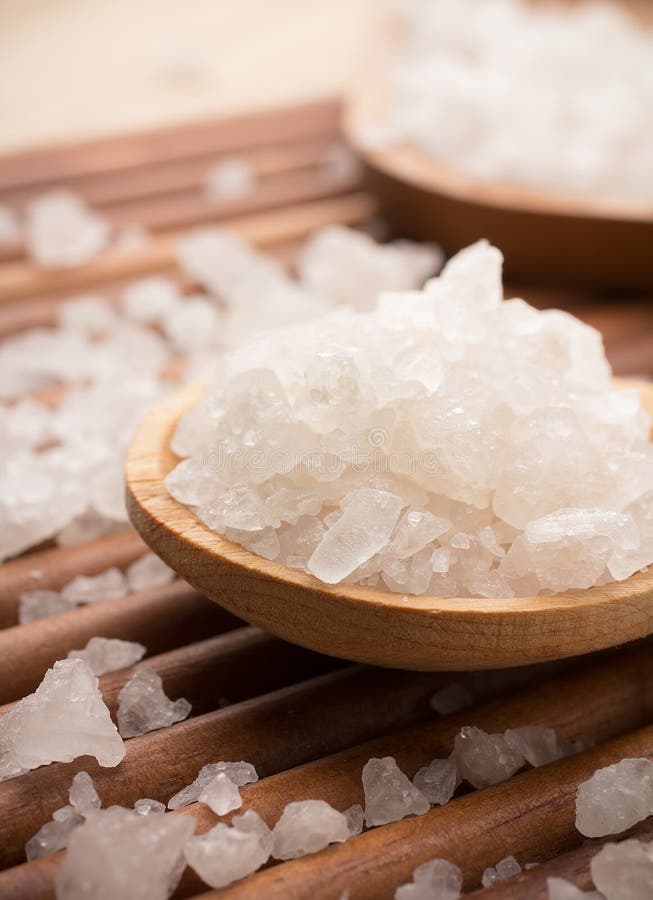
Locate an element on the screen. Image resolution: width=653 pixels, height=900 pixels. left side of wooden bowl is located at coordinates (128, 493).